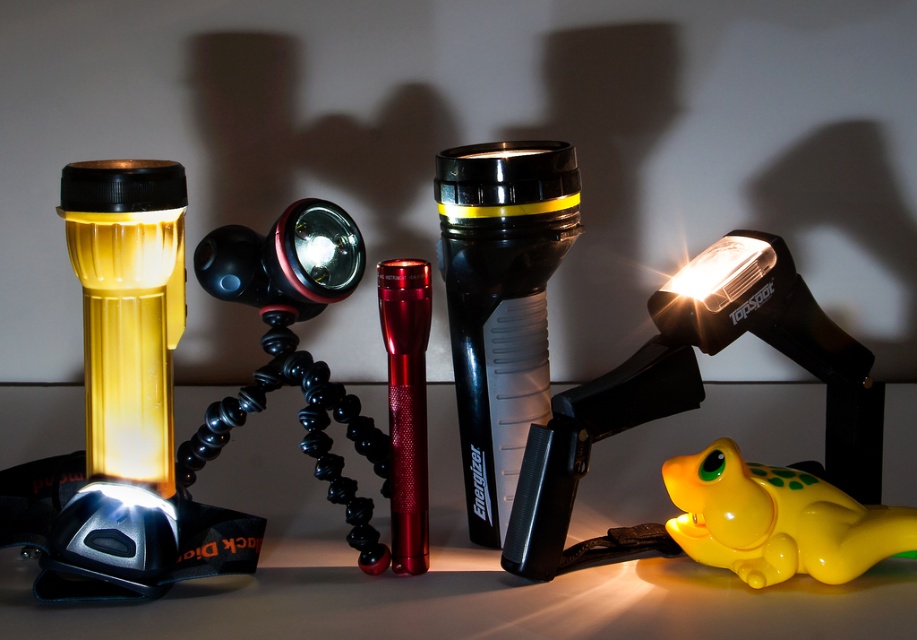
You are organizing a camping gear box and need to fit both the yellow matte flashlight at left and the black plastic flashlight at center. Which flashlight requires more horizontal space to place side by side?

The yellow matte flashlight at left requires more horizontal space because its width is larger than the black plastic flashlight at center.

You are organizing a camping gear kit and need to place the yellow rubber frog at center and the black plastic flashlight at center into a compartment. Which object should you place first to ensure the one behind is visible?

You should place the yellow rubber frog at center first because it is in front of the black plastic flashlight at center, so placing it first will allow the flashlight behind to remain visible.